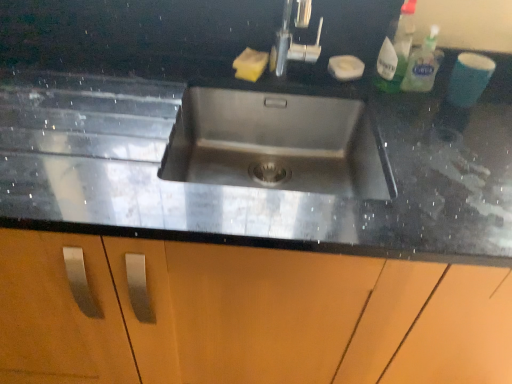
In order to click on free space between white matte soap at upper right, which is the first soap in right-to-left order, and yellow sponge at upper center, which ranks as the first soap in left-to-right order in this screenshot , I will do `click(295, 71)`.